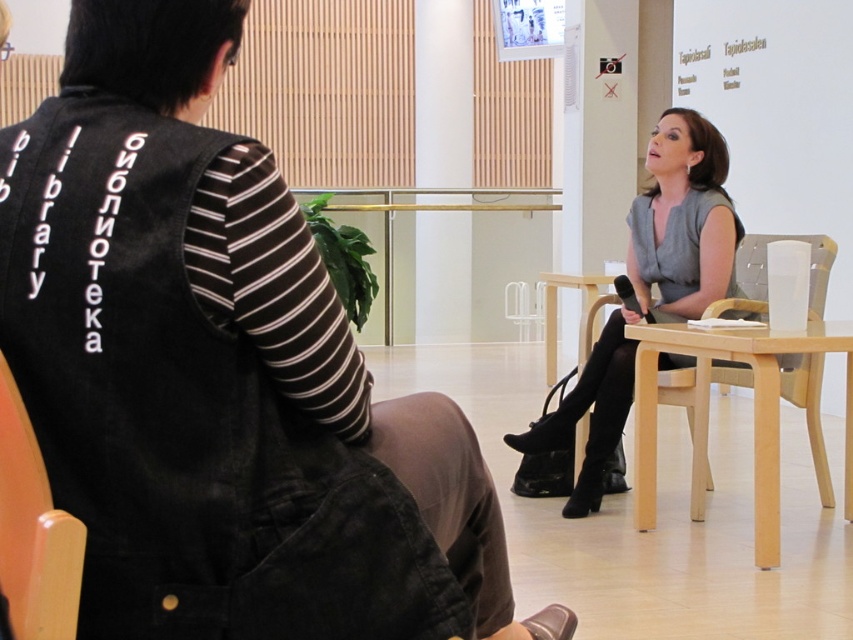
Question: Which point is closer to the camera?

Choices:
 (A) (811, 280)
 (B) (373, 452)

Answer: (B)

Question: Observing the image, what is the correct spatial positioning of denim vest at center in reference to light wood armchair at right?

Choices:
 (A) right
 (B) left

Answer: (B)

Question: Which is farther from the denim vest at center?

Choices:
 (A) matte gray dress at center
 (B) wooden chair at lower left

Answer: (A)

Question: Considering the real-world distances, which object is farthest from the matte gray dress at center?

Choices:
 (A) denim vest at center
 (B) light wood armchair at right

Answer: (A)

Question: Is denim vest at center bigger than wooden chair at lower left?

Choices:
 (A) no
 (B) yes

Answer: (B)

Question: Is denim vest at center in front of wooden chair at lower left?

Choices:
 (A) yes
 (B) no

Answer: (B)